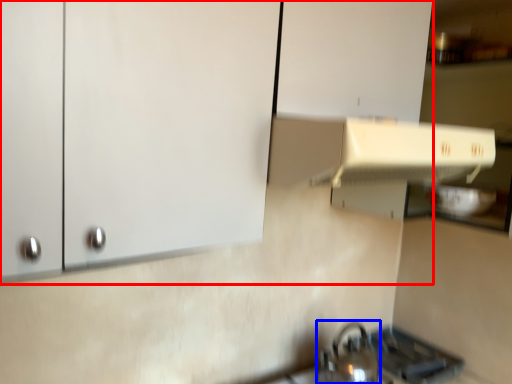
Question: Which object appears farthest to the camera in this image, cabinetry (highlighted by a red box) or tea pot (highlighted by a blue box)?

Choices:
 (A) cabinetry
 (B) tea pot

Answer: (B)